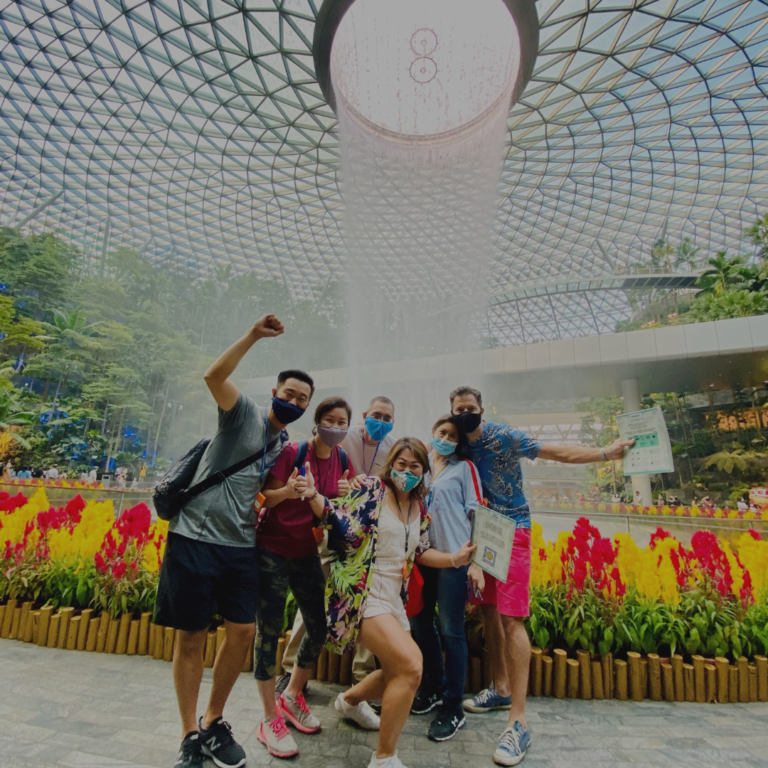
Find the location of a particular element. The height and width of the screenshot is (768, 768). large circular orb in ceiling is located at coordinates (416, 94).